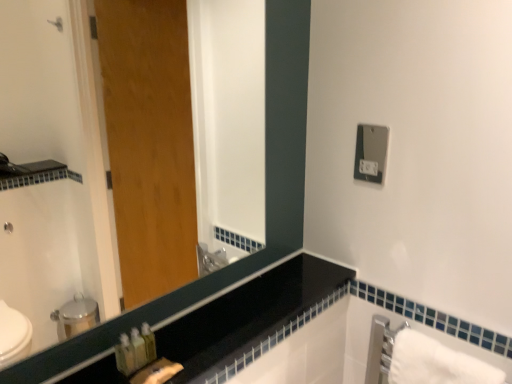
The width and height of the screenshot is (512, 384). Find the location of `black glass mirror at upper left`. black glass mirror at upper left is located at coordinates (266, 197).

This screenshot has width=512, height=384. Find the location of `satin silver outlet at upper right`. satin silver outlet at upper right is located at coordinates (371, 153).

Locate an element on the screen. The height and width of the screenshot is (384, 512). bath towel in front of the satin silver outlet at upper right is located at coordinates (x=436, y=363).

Is the position of white cotton bath towel at lower right more distant than that of satin silver outlet at upper right?

No, the depth of white cotton bath towel at lower right is less than that of satin silver outlet at upper right.

Is white cotton bath towel at lower right taller or shorter than satin silver outlet at upper right?

Clearly, white cotton bath towel at lower right is taller compared to satin silver outlet at upper right.

How many degrees apart are the facing directions of white cotton bath towel at lower right and satin silver outlet at upper right?

The angle between the facing direction of white cotton bath towel at lower right and the facing direction of satin silver outlet at upper right is 2.43 degrees.

Considering the sizes of objects satin silver outlet at upper right and black glossy counter top at lower left in the image provided, who is thinner, satin silver outlet at upper right or black glossy counter top at lower left?

satin silver outlet at upper right is thinner.

From a real-world perspective, is satin silver outlet at upper right beneath black glossy counter top at lower left?

Incorrect, from a real-world perspective, satin silver outlet at upper right is higher than black glossy counter top at lower left.

From the image's perspective, does satin silver outlet at upper right appear lower than black glossy counter top at lower left?

No, from the image's perspective, satin silver outlet at upper right is not beneath black glossy counter top at lower left.

Could black glossy counter top at lower left be considered to be inside satin silver outlet at upper right?

Definitely not — black glossy counter top at lower left is not inside satin silver outlet at upper right.

Is black glass mirror at upper left far away from black glossy counter top at lower left?

black glass mirror at upper left is near black glossy counter top at lower left, not far away.

In the image, is black glass mirror at upper left on the left side or the right side of black glossy counter top at lower left?

Based on their positions, black glass mirror at upper left is located to the left of black glossy counter top at lower left.

Considering the relative sizes of black glass mirror at upper left and black glossy counter top at lower left in the image provided, is black glass mirror at upper left shorter than black glossy counter top at lower left?

No.

Can you confirm if black glossy counter top at lower left is bigger than black glass mirror at upper left?

Incorrect, black glossy counter top at lower left is not larger than black glass mirror at upper left.

Which object is further away from the camera taking this photo, black glossy counter top at lower left or black glass mirror at upper left?

black glossy counter top at lower left is behind.

Is point (258, 316) positioned before point (267, 214)?

Yes, it is in front of point (267, 214).

How distant is black glossy counter top at lower left from black glass mirror at upper left?

black glossy counter top at lower left and black glass mirror at upper left are 6.29 inches apart.

From the image's perspective, is satin silver outlet at upper right located above or below white cotton bath towel at lower right?

From the image's perspective, satin silver outlet at upper right appears above white cotton bath towel at lower right.

The image size is (512, 384). Find the location of `electric outlet behind the white cotton bath towel at lower right`. electric outlet behind the white cotton bath towel at lower right is located at coordinates (371, 153).

Which of these two, satin silver outlet at upper right or white cotton bath towel at lower right, is wider?

white cotton bath towel at lower right.

Is satin silver outlet at upper right turned away from white cotton bath towel at lower right?

No, satin silver outlet at upper right is not facing the opposite direction of white cotton bath towel at lower right.

Considering the relative sizes of white cotton bath towel at lower right and black glossy counter top at lower left in the image provided, is white cotton bath towel at lower right shorter than black glossy counter top at lower left?

No, white cotton bath towel at lower right is not shorter than black glossy counter top at lower left.

Consider the image. Considering the positions of objects white cotton bath towel at lower right and black glossy counter top at lower left in the image provided, who is more to the right, white cotton bath towel at lower right or black glossy counter top at lower left?

white cotton bath towel at lower right.

From a real-world perspective, which is physically above, white cotton bath towel at lower right or black glossy counter top at lower left?

From a 3D spatial view, black glossy counter top at lower left is above.

From the image's perspective, which is below, satin silver outlet at upper right or black glass mirror at upper left?

black glass mirror at upper left.

Is satin silver outlet at upper right aimed at black glass mirror at upper left?

Yes, satin silver outlet at upper right is turned towards black glass mirror at upper left.

You are a GUI agent. You are given a task and a screenshot of the screen. Output one action in this format:
    pyautogui.click(x=<x>, y=<y>)
    Task: Click on the mirror above the satin silver outlet at upper right (from a real-world perspective)
    Image resolution: width=512 pixels, height=384 pixels.
    Given the screenshot: What is the action you would take?
    pyautogui.click(x=266, y=197)

Locate an element on the screen. The width and height of the screenshot is (512, 384). bath towel below the satin silver outlet at upper right (from a real-world perspective) is located at coordinates (436, 363).

Locate an element on the screen. This screenshot has height=384, width=512. electric outlet that appears above the black glossy counter top at lower left (from a real-world perspective) is located at coordinates (371, 153).

Based on their spatial positions, is white cotton bath towel at lower right or black glossy counter top at lower left further from black glass mirror at upper left?

white cotton bath towel at lower right is further to black glass mirror at upper left.

Looking at the image, which one is located closer to black glass mirror at upper left, white cotton bath towel at lower right or satin silver outlet at upper right?

satin silver outlet at upper right is positioned closer to the anchor black glass mirror at upper left.

From the image, which object appears to be farther from white cotton bath towel at lower right, black glass mirror at upper left or satin silver outlet at upper right?

The object further to white cotton bath towel at lower right is black glass mirror at upper left.

Looking at the image, which one is located closer to satin silver outlet at upper right, black glass mirror at upper left or black glossy counter top at lower left?

black glass mirror at upper left.

Considering their positions, is black glass mirror at upper left positioned closer to white cotton bath towel at lower right than black glossy counter top at lower left?

black glossy counter top at lower left lies closer to white cotton bath towel at lower right than the other object.

Based on their spatial positions, is black glass mirror at upper left or white cotton bath towel at lower right closer to black glossy counter top at lower left?

black glass mirror at upper left.

Consider the image. Looking at the image, which one is located closer to satin silver outlet at upper right, black glossy counter top at lower left or black glass mirror at upper left?

Among the two, black glass mirror at upper left is located nearer to satin silver outlet at upper right.

Considering their positions, is satin silver outlet at upper right positioned closer to black glass mirror at upper left than black glossy counter top at lower left?

black glossy counter top at lower left.

The width and height of the screenshot is (512, 384). Identify the location of counter top between black glass mirror at upper left and white cotton bath towel at lower right in the horizontal direction. (248, 314).

Identify the location of electric outlet situated between black glass mirror at upper left and white cotton bath towel at lower right from left to right. (371, 153).

What are the coordinates of `counter top that lies between satin silver outlet at upper right and white cotton bath towel at lower right from top to bottom` in the screenshot? It's located at (248, 314).

The height and width of the screenshot is (384, 512). In order to click on counter top between black glass mirror at upper left and satin silver outlet at upper right from front to back in this screenshot , I will do `click(248, 314)`.